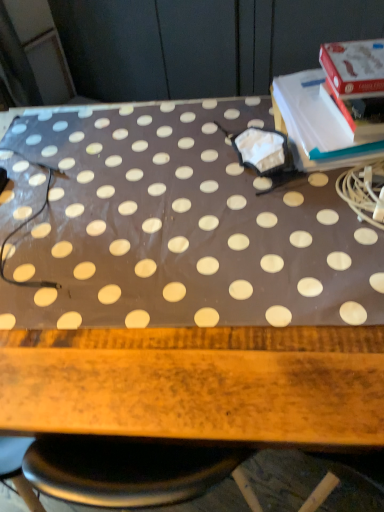
Question: Is white polka dot fabric at center inside or outside of white paper at upper right?

Choices:
 (A) inside
 (B) outside

Answer: (B)

Question: From a real-world perspective, relative to white paper at upper right, is white polka dot fabric at center vertically above or below?

Choices:
 (A) above
 (B) below

Answer: (B)

Question: Visually, is white polka dot fabric at center positioned to the left or to the right of white paper at upper right?

Choices:
 (A) left
 (B) right

Answer: (A)

Question: Considering their positions, is white paper at upper right located in front of or behind white polka dot fabric at center?

Choices:
 (A) behind
 (B) front

Answer: (A)

Question: Is point (284, 105) closer or farther from the camera than point (21, 190)?

Choices:
 (A) farther
 (B) closer

Answer: (A)

Question: Would you say white paper at upper right is inside or outside white polka dot fabric at center?

Choices:
 (A) outside
 (B) inside

Answer: (A)

Question: Based on their positions, is white paper at upper right located to the left or right of white polka dot fabric at center?

Choices:
 (A) left
 (B) right

Answer: (B)